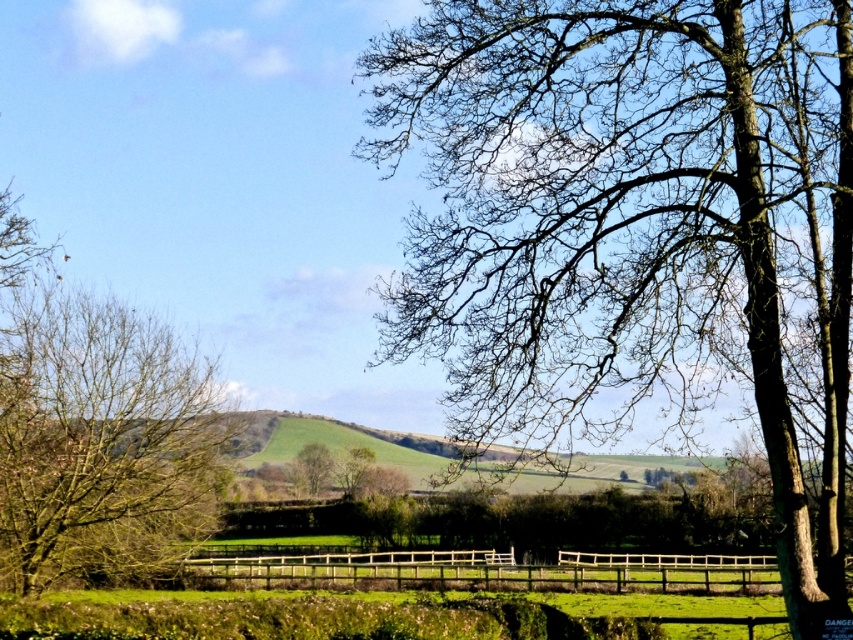
Does bare branches at upper right have a greater height compared to wooden fence at center?

Indeed, bare branches at upper right has a greater height compared to wooden fence at center.

Where is `bare branches at upper right`? bare branches at upper right is located at coordinates (625, 220).

Between bare branches at left and wooden fence at center, which one has more height?

bare branches at left

Is bare branches at left thinner than wooden fence at center?

Indeed, bare branches at left has a lesser width compared to wooden fence at center.

At what (x,y) coordinates should I click in order to perform the action: click on bare branches at left. Please return your answer as a coordinate pair (x, y). This screenshot has width=853, height=640. Looking at the image, I should click on (102, 442).

Locate an element on the screen. This screenshot has height=640, width=853. bare branches at left is located at coordinates (102, 442).

Which is above, bare branches at upper right or bare branches at left?

bare branches at upper right

Is point (717, 259) farther from camera compared to point (155, 416)?

No, it is not.

This screenshot has height=640, width=853. Find the location of `bare branches at upper right`. bare branches at upper right is located at coordinates (625, 220).